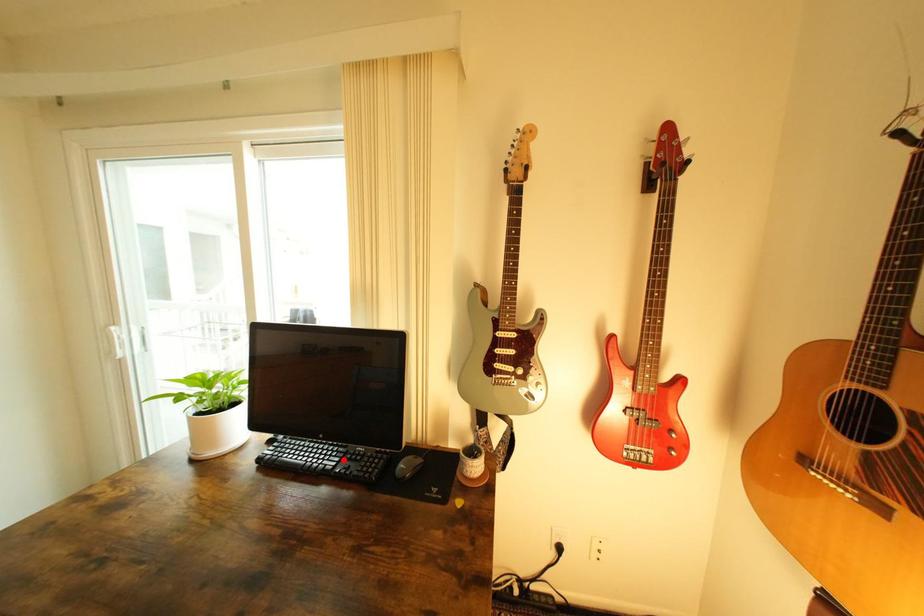
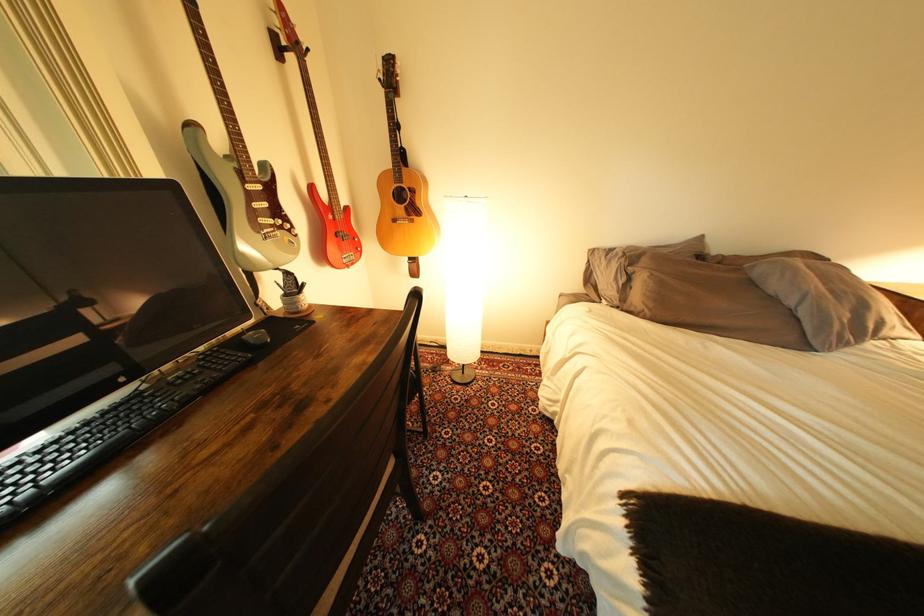
Where in the second image is the point corresponding to the highlighted location from the first image?

(171, 402)